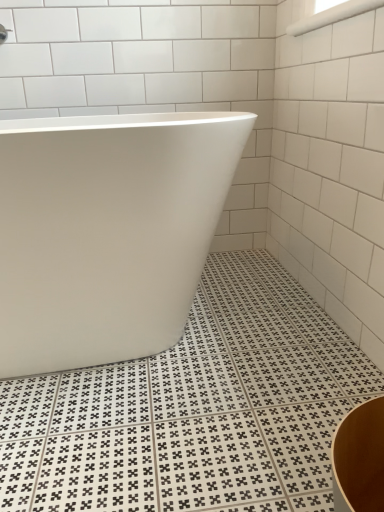
The width and height of the screenshot is (384, 512). Describe the element at coordinates (107, 232) in the screenshot. I see `white glossy bathtub at center` at that location.

What is the approximate height of white glossy bathtub at center?

white glossy bathtub at center is 22.71 inches tall.

The width and height of the screenshot is (384, 512). I want to click on white glossy bathtub at center, so click(x=107, y=232).

I want to click on white glossy grab bar at upper right, so click(x=333, y=15).

Describe the element at coordinates (333, 15) in the screenshot. I see `white glossy grab bar at upper right` at that location.

The width and height of the screenshot is (384, 512). Identify the location of white glossy bathtub at center. (107, 232).

Considering the relative positions of white glossy grab bar at upper right and white glossy bathtub at center in the image provided, is white glossy grab bar at upper right to the left or to the right of white glossy bathtub at center?

white glossy grab bar at upper right is to the right of white glossy bathtub at center.

Based on the photo, considering the relative positions of white glossy grab bar at upper right and white glossy bathtub at center in the image provided, is white glossy grab bar at upper right in front of white glossy bathtub at center?

No, white glossy grab bar at upper right is further to the viewer.

Does point (358, 0) come behind point (38, 361)?

No, it is in front of (38, 361).

From the image's perspective, is white glossy grab bar at upper right above or below white glossy bathtub at center?

Based on their image positions, white glossy grab bar at upper right is located above white glossy bathtub at center.

From a real-world perspective, relative to white glossy bathtub at center, is white glossy grab bar at upper right vertically above or below?

Clearly, from a real-world perspective, white glossy grab bar at upper right is above white glossy bathtub at center.

Which object is thinner, white glossy grab bar at upper right or white glossy bathtub at center?

white glossy grab bar at upper right.

Does white glossy grab bar at upper right have a greater height compared to white glossy bathtub at center?

In fact, white glossy grab bar at upper right may be shorter than white glossy bathtub at center.

Who is smaller, white glossy grab bar at upper right or white glossy bathtub at center?

With smaller size is white glossy grab bar at upper right.

Is white glossy grab bar at upper right not within white glossy bathtub at center?

Yes.

Is white glossy grab bar at upper right next to white glossy bathtub at center?

There is a gap between white glossy grab bar at upper right and white glossy bathtub at center.

Is white glossy grab bar at upper right aimed at white glossy bathtub at center?

No, white glossy grab bar at upper right is not aimed at white glossy bathtub at center.

How different are the orientations of white glossy grab bar at upper right and white glossy bathtub at center in degrees?

89.8 degrees separate the facing orientations of white glossy grab bar at upper right and white glossy bathtub at center.

The image size is (384, 512). Identify the location of window lying above the white glossy bathtub at center (from the image's perspective). (333, 15).

Between white glossy bathtub at center and white glossy grab bar at upper right, which one appears on the right side from the viewer's perspective?

From the viewer's perspective, white glossy grab bar at upper right appears more on the right side.

Looking at this image, which is in front, white glossy bathtub at center or white glossy grab bar at upper right?

Positioned in front is white glossy bathtub at center.

Considering the positions of point (94, 186) and point (362, 1), is point (94, 186) closer or farther from the camera than point (362, 1)?

Point (94, 186) appears to be closer to the viewer than point (362, 1).

From the image's perspective, is white glossy bathtub at center located above or below white glossy grab bar at upper right?

white glossy bathtub at center is situated lower than white glossy grab bar at upper right in the image.

In the scene shown: From a real-world perspective, is white glossy bathtub at center on white glossy grab bar at upper right?

No.

Does white glossy bathtub at center have a lesser width compared to white glossy grab bar at upper right?

Incorrect, the width of white glossy bathtub at center is not less than that of white glossy grab bar at upper right.

Considering the relative sizes of white glossy bathtub at center and white glossy grab bar at upper right in the image provided, is white glossy bathtub at center shorter than white glossy grab bar at upper right?

No.

Consider the image. Who is bigger, white glossy bathtub at center or white glossy grab bar at upper right?

With larger size is white glossy bathtub at center.

Is white glossy grab bar at upper right located within white glossy bathtub at center?

Actually, white glossy grab bar at upper right is outside white glossy bathtub at center.

Is white glossy bathtub at center touching white glossy grab bar at upper right?

white glossy bathtub at center is not next to white glossy grab bar at upper right, and they're not touching.

Is white glossy bathtub at center oriented towards white glossy grab bar at upper right?

No, white glossy bathtub at center is not aimed at white glossy grab bar at upper right.

Identify the location of bathtub below the white glossy grab bar at upper right (from the image's perspective). (107, 232).

Find the location of `window that appears above the white glossy bathtub at center (from a real-world perspective)`. window that appears above the white glossy bathtub at center (from a real-world perspective) is located at coordinates (333, 15).

You are a GUI agent. You are given a task and a screenshot of the screen. Output one action in this format:
    pyautogui.click(x=<x>, y=<y>)
    Task: Click on the window to the right of white glossy bathtub at center
    Image resolution: width=384 pixels, height=512 pixels.
    Given the screenshot: What is the action you would take?
    pyautogui.click(x=333, y=15)